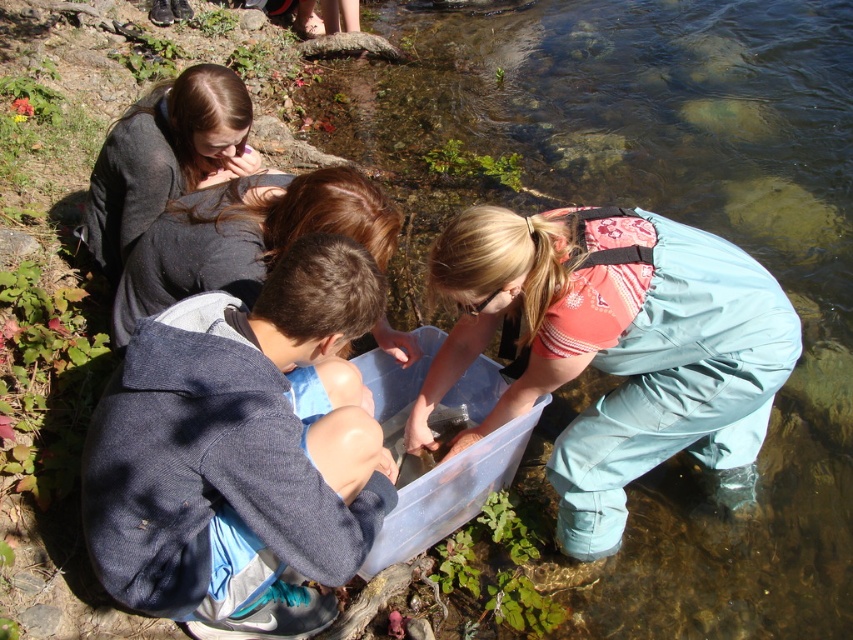
Question: Which object appears closest to the camera in this image?

Choices:
 (A) blue fleece jacket at lower left
 (B) dark gray fabric at upper left
 (C) matte gray hoodie at upper left

Answer: (A)

Question: Can you confirm if blue fleece jacket at lower left is positioned below matte gray hoodie at upper left?

Choices:
 (A) no
 (B) yes

Answer: (B)

Question: Based on their relative distances, which object is farther from the dark gray fabric at upper left?

Choices:
 (A) matte gray hoodie at upper left
 (B) blue fleece jacket at lower left

Answer: (B)

Question: Is matte gray hoodie at upper left bigger than dark gray fabric at upper left?

Choices:
 (A) yes
 (B) no

Answer: (B)

Question: Is blue fleece jacket at lower left to the right of matte gray hoodie at upper left from the viewer's perspective?

Choices:
 (A) yes
 (B) no

Answer: (A)

Question: Which object is farther from the camera taking this photo?

Choices:
 (A) dark gray fabric at upper left
 (B) matte gray hoodie at upper left

Answer: (A)